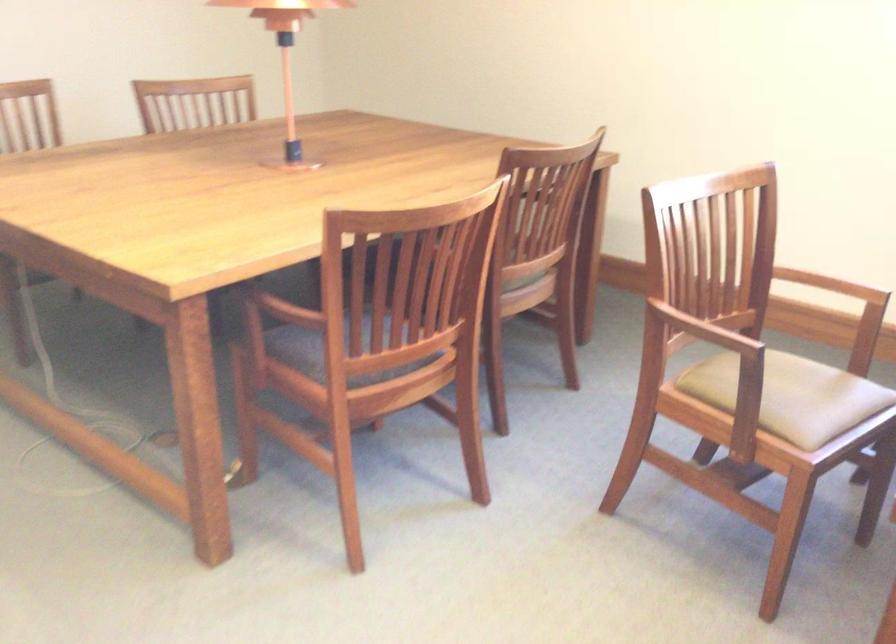
Describe the element at coordinates (712, 334) in the screenshot. I see `a wooden chair armrest` at that location.